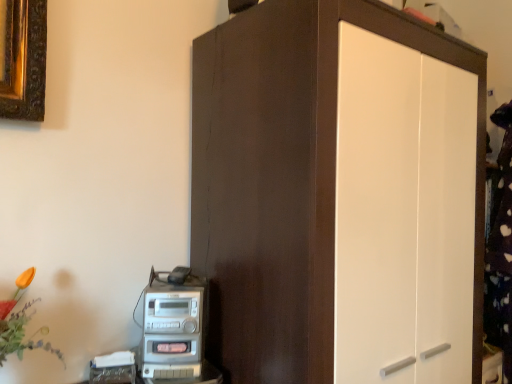
Question: Is silver metallic stereo at lower left not within matte brown cupboard at center?

Choices:
 (A) no
 (B) yes

Answer: (B)

Question: Can you confirm if silver metallic stereo at lower left is shorter than matte brown cupboard at center?

Choices:
 (A) no
 (B) yes

Answer: (B)

Question: From a real-world perspective, is silver metallic stereo at lower left beneath matte brown cupboard at center?

Choices:
 (A) no
 (B) yes

Answer: (B)

Question: Does silver metallic stereo at lower left have a smaller size compared to matte brown cupboard at center?

Choices:
 (A) yes
 (B) no

Answer: (A)

Question: Is silver metallic stereo at lower left positioned far away from matte brown cupboard at center?

Choices:
 (A) no
 (B) yes

Answer: (A)

Question: Could matte brown cupboard at center be considered to be inside silver metallic stereo at lower left?

Choices:
 (A) yes
 (B) no

Answer: (B)

Question: Considering the relative positions of matte brown cupboard at center and silver metallic stereo at lower left in the image provided, is matte brown cupboard at center behind silver metallic stereo at lower left?

Choices:
 (A) no
 (B) yes

Answer: (A)

Question: Can you confirm if matte brown cupboard at center is positioned to the right of silver metallic stereo at lower left?

Choices:
 (A) yes
 (B) no

Answer: (A)

Question: From the image's perspective, would you say matte brown cupboard at center is positioned over silver metallic stereo at lower left?

Choices:
 (A) no
 (B) yes

Answer: (B)

Question: Is matte brown cupboard at center at the left side of silver metallic stereo at lower left?

Choices:
 (A) no
 (B) yes

Answer: (A)

Question: Are matte brown cupboard at center and silver metallic stereo at lower left located far from each other?

Choices:
 (A) no
 (B) yes

Answer: (A)

Question: Does matte brown cupboard at center have a lesser height compared to silver metallic stereo at lower left?

Choices:
 (A) no
 (B) yes

Answer: (A)

Question: In terms of width, does matte brown cupboard at center look wider or thinner when compared to silver metallic stereo at lower left?

Choices:
 (A) thin
 (B) wide

Answer: (B)